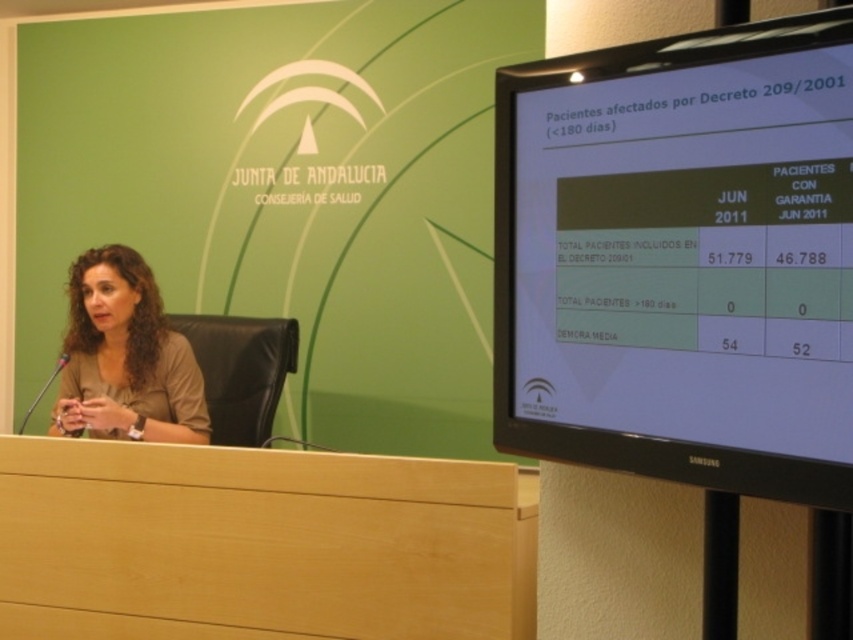
Question: Does matte brown hair at center appear over metallic silver microphone at left?

Choices:
 (A) yes
 (B) no

Answer: (A)

Question: Does black glossy monitor at upper right appear on the right side of matte brown hair at center?

Choices:
 (A) no
 (B) yes

Answer: (B)

Question: Considering the real-world distances, which object is farthest from the metallic silver microphone at left?

Choices:
 (A) black glossy monitor at upper right
 (B) light wood table at lower left

Answer: (A)

Question: Is black glossy monitor at upper right further to camera compared to light wood table at lower left?

Choices:
 (A) yes
 (B) no

Answer: (B)

Question: Which of these objects is positioned closest to the metallic silver microphone at left?

Choices:
 (A) black glossy monitor at upper right
 (B) matte brown hair at center

Answer: (B)

Question: Which point is farther from the camera taking this photo?

Choices:
 (A) (21, 422)
 (B) (370, 572)
 (C) (753, 428)

Answer: (A)